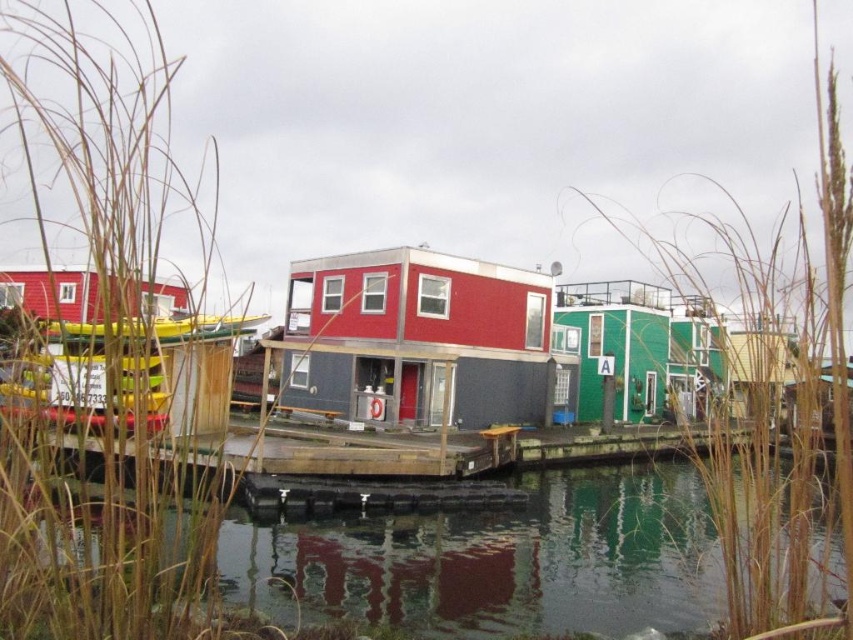
Question: Which point is farther to the camera?

Choices:
 (A) matte red boat at left
 (B) green reflective water at lower center
 (C) wooden dock at center
 (D) brown grass at left

Answer: (B)

Question: Is green reflective water at lower center wider than green matte houseboat at center-right?

Choices:
 (A) yes
 (B) no

Answer: (B)

Question: Which of the following is the farthest from the observer?

Choices:
 (A) (119, 269)
 (B) (399, 560)
 (C) (62, 268)

Answer: (C)

Question: Is green reflective water at lower center to the right of green matte houseboat at center-right from the viewer's perspective?

Choices:
 (A) no
 (B) yes

Answer: (A)

Question: Which object appears closest to the camera in this image?

Choices:
 (A) green matte houseboat at center-right
 (B) brown grass at left
 (C) matte red houseboat at center
 (D) green reflective water at lower center

Answer: (B)

Question: Can you confirm if wooden dock at center is positioned below matte red boat at left?

Choices:
 (A) no
 (B) yes

Answer: (B)